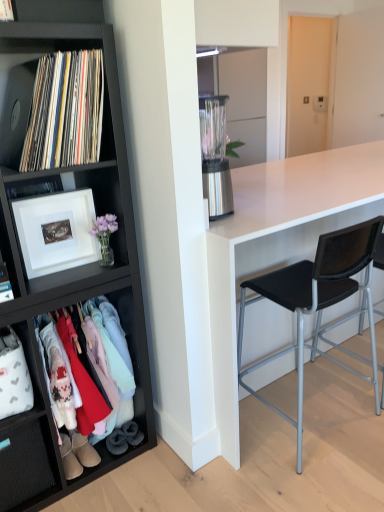
Find the location of a particular element. black vinyl records at left is located at coordinates (65, 111).

Based on the photo, what is the approximate width of stainless steel blender at center?

The width of stainless steel blender at center is 16.47 centimeters.

Describe the element at coordinates (68, 270) in the screenshot. I see `black matte bookcase at left` at that location.

You are a GUI agent. You are given a task and a screenshot of the screen. Output one action in this format:
    pyautogui.click(x=<x>, y=<y>)
    Task: Click on the light brown suede boot at lower left, which ranks as the first footwear in right-to-left order
    Image resolution: width=384 pixels, height=512 pixels.
    Given the screenshot: What is the action you would take?
    pyautogui.click(x=83, y=450)

Describe the element at coordinates (132, 433) in the screenshot. This screenshot has width=384, height=512. I see `soft gray suede boot at lower left, positioned as the 1th shoe in right-to-left order` at that location.

Where is `leather boot at lower left, which appears as the second footwear when viewed from the right`? leather boot at lower left, which appears as the second footwear when viewed from the right is located at coordinates (69, 459).

Where is `black vinyl records at left`? This screenshot has height=512, width=384. black vinyl records at left is located at coordinates (65, 111).

Which shoe is the 1st one when counting from the right side of the white matte picture frame at left? Please provide its 2D coordinates.

[(117, 442)]

From the image's perspective, is white matte picture frame at left positioned above or below velvet grey boot at lower left, the 1th shoe from the left?

Clearly, from the image's perspective, white matte picture frame at left is above velvet grey boot at lower left, the 1th shoe from the left.

Who is more distant, white matte picture frame at left or velvet grey boot at lower left, which is counted as the second shoe, starting from the right?

Positioned behind is velvet grey boot at lower left, which is counted as the second shoe, starting from the right.

From a real-world perspective, which is physically above, velvet grey boot at lower left, the 1th shoe from the left, or black mesh chair at right, which is the 1th chair in left-to-right order?

In real-world perspective, black mesh chair at right, which is the 1th chair in left-to-right order, is above.

Would you say velvet grey boot at lower left, the 1th shoe from the left, is outside black mesh chair at right, which is the 1th chair in left-to-right order?

velvet grey boot at lower left, the 1th shoe from the left, is positioned outside black mesh chair at right, which is the 1th chair in left-to-right order.

From a real-world perspective, is black vinyl records at left positioned above or below white fabric drawer at lower left?

Clearly, from a real-world perspective, black vinyl records at left is above white fabric drawer at lower left.

Looking at this image, is black vinyl records at left closer to the viewer compared to white fabric drawer at lower left?

Yes, it is.

Are black vinyl records at left and white fabric drawer at lower left making contact?

No, black vinyl records at left is not next to white fabric drawer at lower left.

Does point (44, 59) appear closer or farther from the camera than point (2, 459)?

Point (44, 59) is positioned closer to the camera compared to point (2, 459).

From a real-world perspective, relative to black matte bookcase at left, is light brown suede boot at lower left, which ranks as the first footwear in right-to-left order, vertically above or below?

light brown suede boot at lower left, which ranks as the first footwear in right-to-left order, is below black matte bookcase at left.

Is light brown suede boot at lower left, the second footwear when ordered from left to right, facing away from black matte bookcase at left?

That's right, light brown suede boot at lower left, the second footwear when ordered from left to right, is facing away from black matte bookcase at left.

Would you consider light brown suede boot at lower left, which ranks as the first footwear in right-to-left order, to be distant from black matte bookcase at left?

They are positioned close to each other.

Considering the sizes of objects black matte bookcase at left and matte black clothing rack at lower left in the image provided, who is shorter, black matte bookcase at left or matte black clothing rack at lower left?

With less height is matte black clothing rack at lower left.

Is black matte bookcase at left aimed at matte black clothing rack at lower left?

Yes, black matte bookcase at left is facing matte black clothing rack at lower left.

Considering the positions of objects black matte bookcase at left and matte black clothing rack at lower left in the image provided, who is more to the left, black matte bookcase at left or matte black clothing rack at lower left?

Positioned to the left is black matte bookcase at left.

From the image's perspective, which one is positioned higher, black matte bookcase at left or matte black clothing rack at lower left?

black matte bookcase at left.

Find the location of `picture frame above the black mesh chair at right, which is the 1th chair in left-to-right order (from a real-world perspective)`. picture frame above the black mesh chair at right, which is the 1th chair in left-to-right order (from a real-world perspective) is located at coordinates (56, 231).

Who is smaller, white matte picture frame at left or black mesh chair at right, the second chair viewed from the right?

white matte picture frame at left is smaller.

Are white matte picture frame at left and black mesh chair at right, which is the 1th chair in left-to-right order, located far from each other?

They are positioned close to each other.

From the picture: Can you confirm if black plastic chair at right, which ranks as the 2th chair in left-to-right order, is positioned to the right of stainless steel blender at center?

Correct, you'll find black plastic chair at right, which ranks as the 2th chair in left-to-right order, to the right of stainless steel blender at center.

From a real-world perspective, relative to stainless steel blender at center, is black plastic chair at right, acting as the first chair starting from the right, vertically above or below?

black plastic chair at right, acting as the first chair starting from the right, is below stainless steel blender at center.

From the image's perspective, which is above, black plastic chair at right, acting as the first chair starting from the right, or stainless steel blender at center?

From the image's view, stainless steel blender at center is above.

What are the coordinates of `chair that is the 2nd object directly below the stainless steel blender at center (from a real-world perspective)` in the screenshot? It's located at click(348, 267).

At what (x,y) coordinates should I click in order to perform the action: click on picture frame that appears on the left of velvet grey boot at lower left, the 1th shoe from the left. Please return your answer as a coordinate pair (x, y). Looking at the image, I should click on (56, 231).

There is a velvet grey boot at lower left, which is counted as the second shoe, starting from the right. At what (x,y) coordinates should I click in order to perform the action: click on the 1st chair above it (from the image's perspective). Please return your answer as a coordinate pair (x, y). Looking at the image, I should click on (317, 301).

Considering their positions, is white fabric drawer at lower left positioned closer to leather boot at lower left, which appears as the second footwear when viewed from the right, than soft gray suede boot at lower left, which appears as the 2th shoe when viewed from the left?

The object closer to leather boot at lower left, which appears as the second footwear when viewed from the right, is white fabric drawer at lower left.

Estimate the real-world distances between objects in this image. Which object is closer to velvet grey boot at lower left, the 1th shoe from the left, matte black clothing rack at lower left or black vinyl records at left?

Based on the image, matte black clothing rack at lower left appears to be nearer to velvet grey boot at lower left, the 1th shoe from the left.

When comparing their distances from white matte picture frame at left, does black mesh chair at right, which is the 1th chair in left-to-right order, or velvet grey boot at lower left, the 1th shoe from the left, seem further?

black mesh chair at right, which is the 1th chair in left-to-right order, is further to white matte picture frame at left.

Which object lies nearer to the anchor point velvet grey boot at lower left, which is counted as the second shoe, starting from the right, white fabric drawer at lower left or white matte picture frame at left?

The object closer to velvet grey boot at lower left, which is counted as the second shoe, starting from the right, is white fabric drawer at lower left.

From the image, which object appears to be farther from white fabric drawer at lower left, black mesh chair at right, which is the 1th chair in left-to-right order, or leather boot at lower left, which appears as the second footwear when viewed from the right?

black mesh chair at right, which is the 1th chair in left-to-right order.

Based on their spatial positions, is matte black clothing rack at lower left or velvet grey boot at lower left, the 1th shoe from the left, further from leather boot at lower left, which appears as the second footwear when viewed from the right?

matte black clothing rack at lower left is positioned further to the anchor leather boot at lower left, which appears as the second footwear when viewed from the right.

Based on their spatial positions, is black mesh chair at right, the second chair viewed from the right, or white fabric drawer at lower left further from black vinyl records at left?

The object further to black vinyl records at left is black mesh chair at right, the second chair viewed from the right.

When comparing their distances from stainless steel blender at center, does white matte picture frame at left or velvet grey boot at lower left, which is counted as the second shoe, starting from the right, seem further?

The object further to stainless steel blender at center is velvet grey boot at lower left, which is counted as the second shoe, starting from the right.

Image resolution: width=384 pixels, height=512 pixels. Find the location of `shelf between black matte bookcase at left and light brown suede boot at lower left, which ranks as the first footwear in right-to-left order, in the front-back direction`. shelf between black matte bookcase at left and light brown suede boot at lower left, which ranks as the first footwear in right-to-left order, in the front-back direction is located at coordinates (48, 397).

This screenshot has width=384, height=512. In order to click on drawer between stainless steel blender at center and light brown suede boot at lower left, which ranks as the first footwear in right-to-left order, vertically in this screenshot , I will do `click(24, 466)`.

Identify the location of shelf between leather boot at lower left, which is the first footwear from left to right, and black plastic chair at right, acting as the first chair starting from the right, in the horizontal direction. The height and width of the screenshot is (512, 384). (48, 397).

The height and width of the screenshot is (512, 384). Identify the location of drawer between stainless steel blender at center and velvet grey boot at lower left, which is counted as the second shoe, starting from the right, from top to bottom. (24, 466).